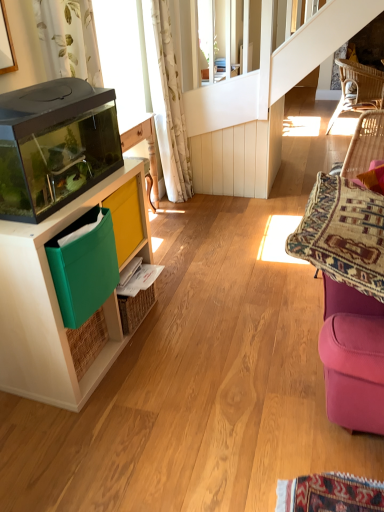
Question: From a real-world perspective, is matte wood cabinet at left located beneath white floral fabric curtain at upper left?

Choices:
 (A) no
 (B) yes

Answer: (B)

Question: Is matte wood cabinet at left looking in the opposite direction of white floral fabric curtain at upper left?

Choices:
 (A) no
 (B) yes

Answer: (A)

Question: Is matte wood cabinet at left next to white floral fabric curtain at upper left and touching it?

Choices:
 (A) yes
 (B) no

Answer: (B)

Question: Can you confirm if matte wood cabinet at left is bigger than white floral fabric curtain at upper left?

Choices:
 (A) no
 (B) yes

Answer: (B)

Question: Considering the relative sizes of matte wood cabinet at left and white floral fabric curtain at upper left in the image provided, is matte wood cabinet at left taller than white floral fabric curtain at upper left?

Choices:
 (A) no
 (B) yes

Answer: (A)

Question: From their relative heights in the image, would you say matte wood cabinet at left is taller or shorter than woven rattan chair at upper right?

Choices:
 (A) short
 (B) tall

Answer: (A)

Question: Considering the positions of point (66, 382) and point (354, 83), is point (66, 382) closer or farther from the camera than point (354, 83)?

Choices:
 (A) farther
 (B) closer

Answer: (B)

Question: Considering the positions of matte wood cabinet at left and woven rattan chair at upper right in the image, is matte wood cabinet at left wider or thinner than woven rattan chair at upper right?

Choices:
 (A) wide
 (B) thin

Answer: (B)

Question: Based on their sizes in the image, would you say matte wood cabinet at left is bigger or smaller than woven rattan chair at upper right?

Choices:
 (A) big
 (B) small

Answer: (B)

Question: From a real-world perspective, relative to matte wood cabinet at left, is green plastic bin at left vertically above or below?

Choices:
 (A) below
 (B) above

Answer: (B)

Question: Is green plastic bin at left in front of or behind matte wood cabinet at left in the image?

Choices:
 (A) behind
 (B) front

Answer: (A)

Question: From the image's perspective, relative to matte wood cabinet at left, is green plastic bin at left above or below?

Choices:
 (A) below
 (B) above

Answer: (B)

Question: Is point (122, 217) closer or farther from the camera than point (117, 170)?

Choices:
 (A) closer
 (B) farther

Answer: (B)

Question: Is green plastic bin at left taller or shorter than white floral fabric curtain at upper left?

Choices:
 (A) short
 (B) tall

Answer: (A)

Question: Is green plastic bin at left in front of or behind white floral fabric curtain at upper left in the image?

Choices:
 (A) front
 (B) behind

Answer: (A)